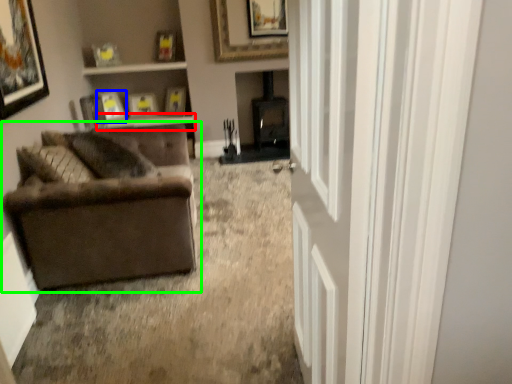
Question: Which object is positioned closest to window sill (highlighted by a red box)? Select from picture frame (highlighted by a blue box) and studio couch (highlighted by a green box).

Choices:
 (A) picture frame
 (B) studio couch

Answer: (A)